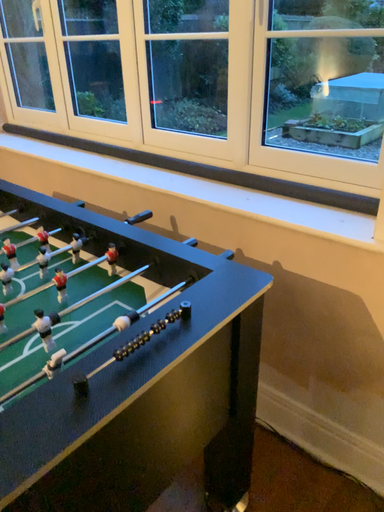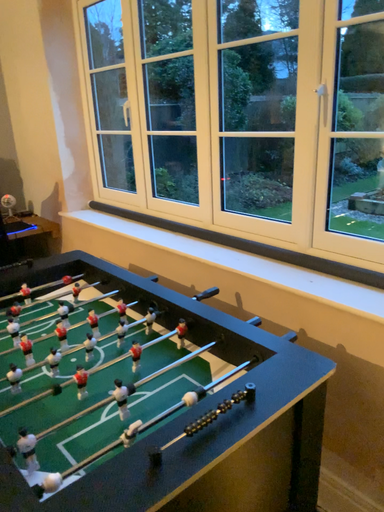
Question: Which way did the camera rotate in the video?

Choices:
 (A) rotated downward
 (B) rotated upward

Answer: (B)